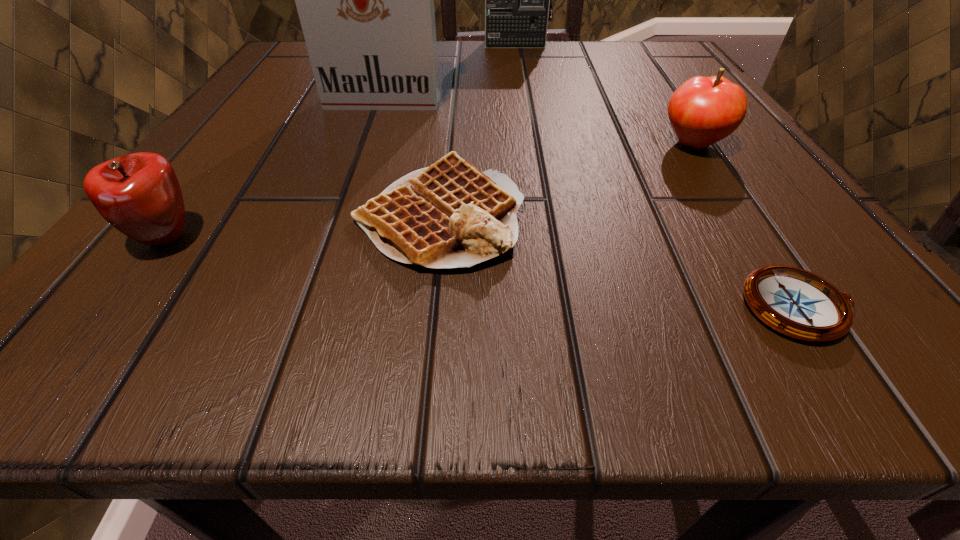
Where is `object that stands as the third closest to the farthest object`? The width and height of the screenshot is (960, 540). object that stands as the third closest to the farthest object is located at coordinates (448, 215).

The width and height of the screenshot is (960, 540). I want to click on free space that satisfies the following two spatial constraints: 1. with the lid open on the fifth tallest object; 2. on the right side of the cigarette case, so click(344, 216).

The height and width of the screenshot is (540, 960). Find the location of `vacant space that satisfies the following two spatial constraints: 1. on the front side of the nearer apple; 2. on the right side of the compass`. vacant space that satisfies the following two spatial constraints: 1. on the front side of the nearer apple; 2. on the right side of the compass is located at coordinates (113, 307).

Locate an element on the screen. Image resolution: width=960 pixels, height=540 pixels. free space that satisfies the following two spatial constraints: 1. on the front side of the waffle; 2. on the left side of the compass is located at coordinates (430, 307).

The width and height of the screenshot is (960, 540). What are the coordinates of `free region that satisfies the following two spatial constraints: 1. with the lid open on the fifth nearest object; 2. on the right side of the third farthest object` in the screenshot? It's located at (369, 144).

Where is `vacant space that satisfies the following two spatial constraints: 1. with the lid open on the waffle; 2. on the right side of the second farthest object`? The height and width of the screenshot is (540, 960). vacant space that satisfies the following two spatial constraints: 1. with the lid open on the waffle; 2. on the right side of the second farthest object is located at coordinates (344, 216).